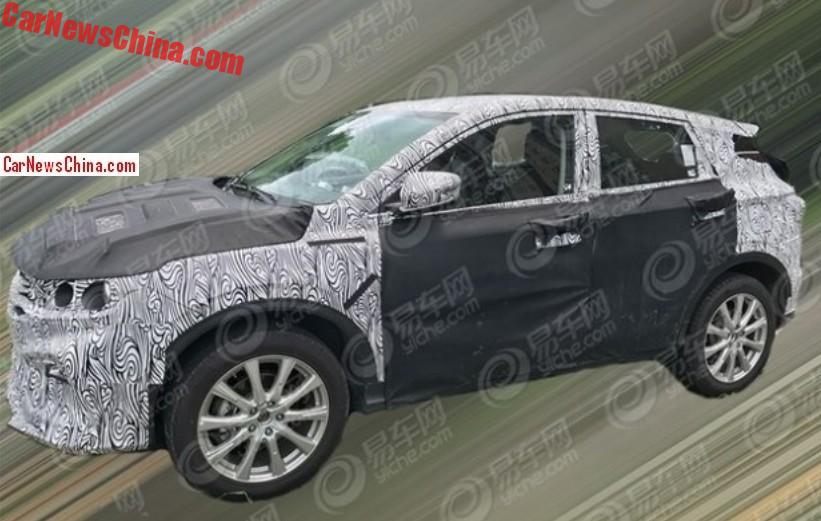
The image size is (821, 521). Find the location of `mirror`. mirror is located at coordinates (442, 185).